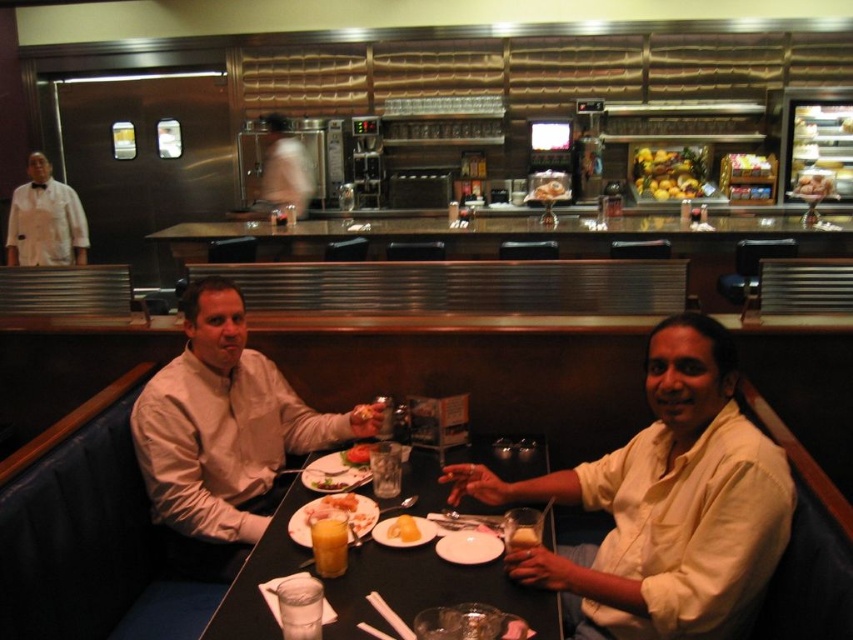
You are a customer sitting at the counter in the diner. You want to reach both the point at coordinate (668, 602) and the point at coordinate (799, 180). Which coordinate point will require you to reach further away from your seat?

The point at coordinate (799, 180) will require reaching further away from your seat because it is farther from the viewer compared to the point at coordinate (668, 602).

You are a server in a diner and need to place a new menu on the counter. The menu is 10 inches wide. You see the matte white plate at center and the golden brown bread at lower center. Which object can the menu fit next to without overlapping?

The matte white plate at center has a greater width than the golden brown bread at lower center, so the menu can fit next to the matte white plate at center since it has more space available.

You are a customer at the diner and want to place your napkin between the matte white plate at center and the golden brown bread at lower center. Based on their positions, which object should you use as a reference point to ensure the napkin is placed correctly?

The matte white plate at center is to the left of the golden brown bread at lower center, so you should place the napkin to the right of the matte white plate at center or to the left of the golden brown bread at lower center to position it between them.